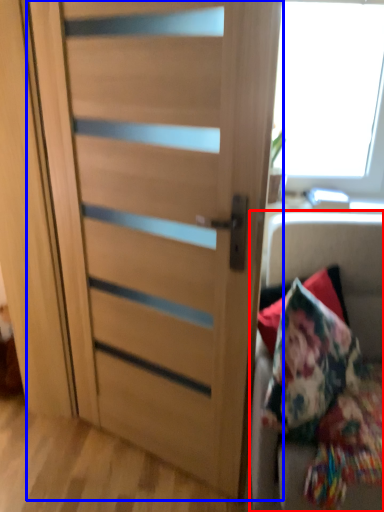
Question: Which object appears closest to the camera in this image, furniture (highlighted by a red box) or door (highlighted by a blue box)?

Choices:
 (A) furniture
 (B) door

Answer: (B)